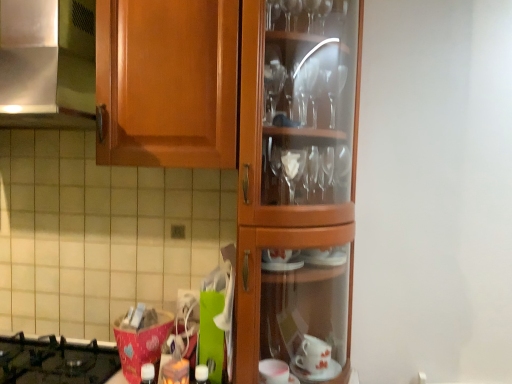
Question: Does satin silver metal at upper left have a smaller size compared to black glass gas stove at lower left?

Choices:
 (A) yes
 (B) no

Answer: (B)

Question: From a real-world perspective, is satin silver metal at upper left on black glass gas stove at lower left?

Choices:
 (A) no
 (B) yes

Answer: (B)

Question: From the image's perspective, is satin silver metal at upper left on black glass gas stove at lower left?

Choices:
 (A) yes
 (B) no

Answer: (A)

Question: Is black glass gas stove at lower left inside satin silver metal at upper left?

Choices:
 (A) no
 (B) yes

Answer: (A)

Question: From the image's perspective, would you say satin silver metal at upper left is shown under black glass gas stove at lower left?

Choices:
 (A) yes
 (B) no

Answer: (B)

Question: Is point (x=196, y=367) positioned closer to the camera than point (x=20, y=360)?

Choices:
 (A) farther
 (B) closer

Answer: (B)

Question: From a real-world perspective, is white matte bottle at center physically located above or below black glass gas stove at lower left?

Choices:
 (A) below
 (B) above

Answer: (B)

Question: Is white matte bottle at center spatially inside black glass gas stove at lower left, or outside of it?

Choices:
 (A) outside
 (B) inside

Answer: (A)

Question: Looking at the image, does white matte bottle at center seem bigger or smaller compared to black glass gas stove at lower left?

Choices:
 (A) small
 (B) big

Answer: (A)

Question: Relative to satin silver metal at upper left, is black glass gas stove at lower left in front or behind?

Choices:
 (A) front
 (B) behind

Answer: (B)

Question: From a real-world perspective, is black glass gas stove at lower left physically located above or below satin silver metal at upper left?

Choices:
 (A) above
 (B) below

Answer: (B)

Question: Looking at their shapes, would you say black glass gas stove at lower left is wider or thinner than satin silver metal at upper left?

Choices:
 (A) wide
 (B) thin

Answer: (B)

Question: Which is correct: black glass gas stove at lower left is inside satin silver metal at upper left, or outside of it?

Choices:
 (A) inside
 (B) outside

Answer: (B)

Question: In terms of height, does white matte bottle at center look taller or shorter compared to satin silver metal at upper left?

Choices:
 (A) short
 (B) tall

Answer: (A)

Question: Based on their positions, is white matte bottle at center located to the left or right of satin silver metal at upper left?

Choices:
 (A) right
 (B) left

Answer: (A)